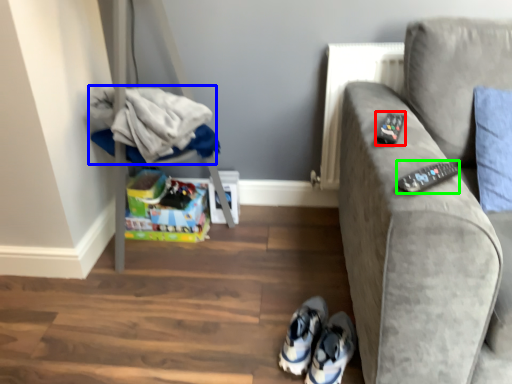
Question: Estimate the real-world distances between objects in this image. Which object is farther from remote (highlighted by a red box), laundry (highlighted by a blue box) or remote (highlighted by a green box)?

Choices:
 (A) laundry
 (B) remote

Answer: (A)